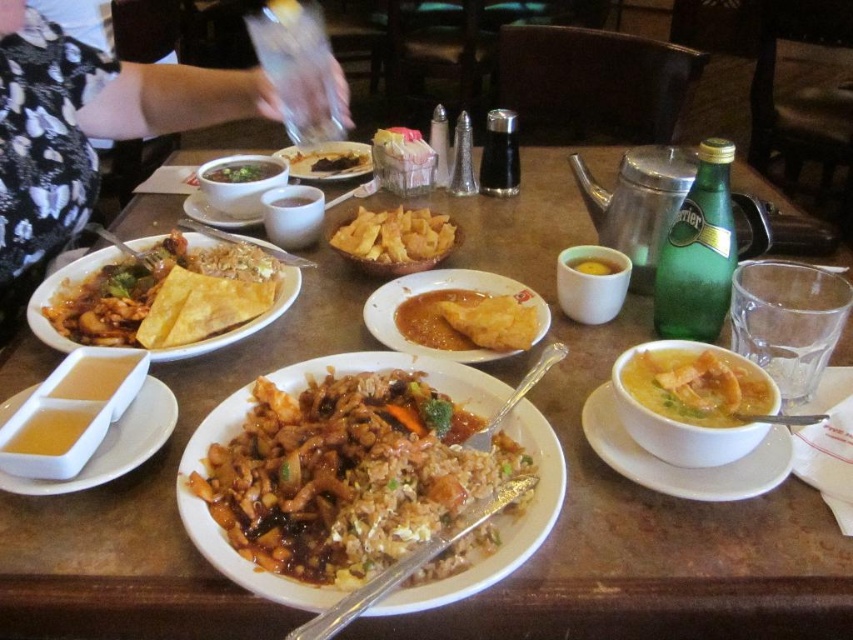
Question: Can you confirm if shiny brown rice at left is positioned to the left of yellow creamy soup at center right?

Choices:
 (A) yes
 (B) no

Answer: (A)

Question: Which of these objects is positioned farthest from the green leafy vegetable at center?

Choices:
 (A) brown glossy fried rice at center
 (B) golden crispy pastry at center
 (C) yellow matte cup at center

Answer: (A)

Question: Which object appears closest to the camera in this image?

Choices:
 (A) golden crispy pastry at center
 (B) golden crispy chips at center
 (C) black lace dress at left
 (D) translucent plastic container at center left

Answer: (D)

Question: Which point appears closest to the camera in this image?

Choices:
 (A) (677, 419)
 (B) (65, 451)

Answer: (A)

Question: Is matte white bowl at center right closer to camera compared to yellow matte cup at center?

Choices:
 (A) yes
 (B) no

Answer: (A)

Question: Does golden crispy chips at center appear over translucent plastic container at center left?

Choices:
 (A) no
 (B) yes

Answer: (B)